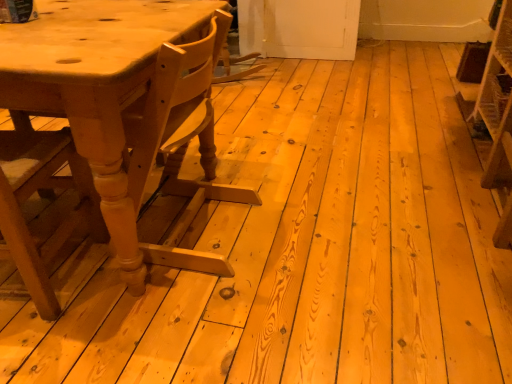
Question: Is wooden crate at right to the right of light brown wood table at left from the viewer's perspective?

Choices:
 (A) yes
 (B) no

Answer: (A)

Question: From a real-world perspective, is wooden crate at right below light brown wood table at left?

Choices:
 (A) no
 (B) yes

Answer: (B)

Question: From the image's perspective, is wooden crate at right located above light brown wood table at left?

Choices:
 (A) yes
 (B) no

Answer: (A)

Question: Can you confirm if wooden crate at right is smaller than light brown wood table at left?

Choices:
 (A) no
 (B) yes

Answer: (B)

Question: Is wooden crate at right not inside light brown wood table at left?

Choices:
 (A) yes
 (B) no

Answer: (A)

Question: Is light brown wood table at left wider or thinner than wooden crate at right?

Choices:
 (A) thin
 (B) wide

Answer: (B)

Question: In the image, is light brown wood table at left positioned in front of or behind wooden crate at right?

Choices:
 (A) behind
 (B) front

Answer: (B)

Question: From their relative heights in the image, would you say light brown wood table at left is taller or shorter than wooden crate at right?

Choices:
 (A) short
 (B) tall

Answer: (B)

Question: Is light brown wood table at left inside the boundaries of wooden crate at right, or outside?

Choices:
 (A) outside
 (B) inside

Answer: (A)

Question: Looking at their shapes, would you say wooden crate at right is wider or thinner than wooden chair at left?

Choices:
 (A) thin
 (B) wide

Answer: (A)

Question: Is point (477, 77) closer or farther from the camera than point (22, 266)?

Choices:
 (A) farther
 (B) closer

Answer: (A)

Question: Looking at the image, does wooden crate at right seem bigger or smaller compared to wooden chair at left?

Choices:
 (A) big
 (B) small

Answer: (B)

Question: From the image's perspective, relative to wooden chair at left, is wooden crate at right above or below?

Choices:
 (A) above
 (B) below

Answer: (A)

Question: Is light brown wood table at left wider or thinner than wooden chair at left?

Choices:
 (A) wide
 (B) thin

Answer: (A)

Question: In terms of size, does light brown wood table at left appear bigger or smaller than wooden chair at left?

Choices:
 (A) big
 (B) small

Answer: (A)